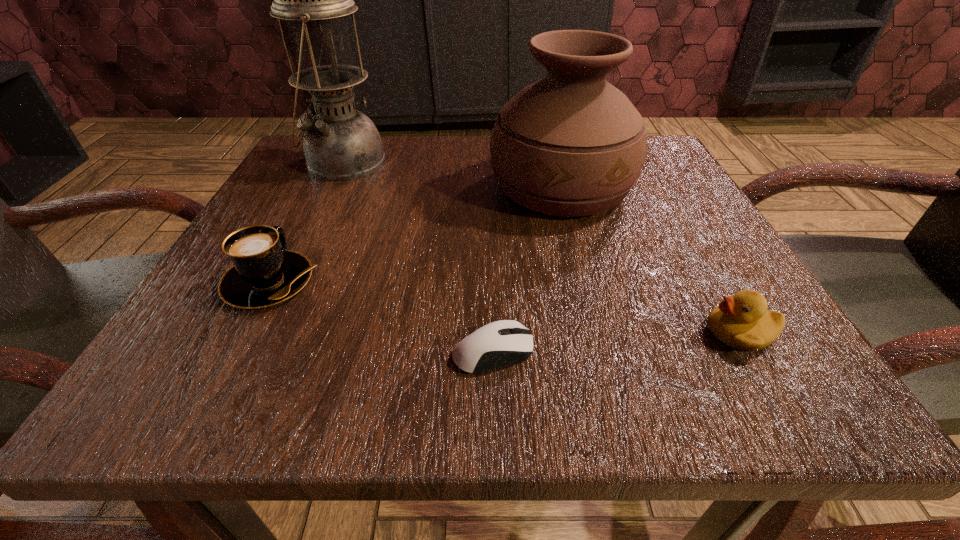
Image resolution: width=960 pixels, height=540 pixels. In order to click on vacant space that's between the mouse and the cappuccino in this screenshot , I will do `click(381, 316)`.

Find the location of `vacant area that lies between the tallest object and the shortest object`. vacant area that lies between the tallest object and the shortest object is located at coordinates (419, 256).

Where is `vacant space that's between the oil lamp and the mouse`? vacant space that's between the oil lamp and the mouse is located at coordinates (419, 256).

This screenshot has height=540, width=960. Identify the location of unoccupied area between the mouse and the cappuccino. (381, 316).

The height and width of the screenshot is (540, 960). Find the location of `free spot between the rightmost object and the cappuccino`. free spot between the rightmost object and the cappuccino is located at coordinates (504, 307).

At what (x,y) coordinates should I click in order to perform the action: click on vacant point located between the cappuccino and the shortest object. Please return your answer as a coordinate pair (x, y). This screenshot has width=960, height=540. Looking at the image, I should click on coord(381,316).

You are a GUI agent. You are given a task and a screenshot of the screen. Output one action in this format:
    pyautogui.click(x=<x>, y=<y>)
    Task: Click on the vacant space that is in between the oil lamp and the mouse
    
    Given the screenshot: What is the action you would take?
    pyautogui.click(x=419, y=256)

What are the coordinates of `free space between the rightmost object and the tallest object` in the screenshot? It's located at pos(541,247).

You are a GUI agent. You are given a task and a screenshot of the screen. Output one action in this format:
    pyautogui.click(x=<x>, y=<y>)
    Task: Click on the empty space that is in between the cappuccino and the urn
    
    Given the screenshot: What is the action you would take?
    pyautogui.click(x=416, y=234)

Identify the location of object that stands as the fourth closest to the second tallest object. (264, 273).